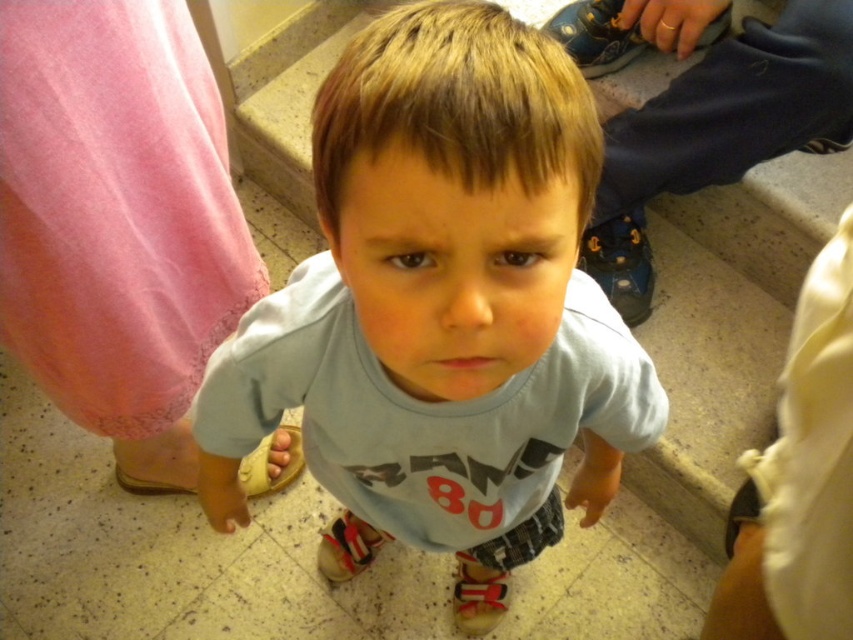
You are a photographer trying to capture a photo of the child in the hallway. You notice two points marked in the image. Which of the two points, point (344, 458) or point (137, 492), is closer to the camera and thus likely to be in focus if you focus on it?

Point (344, 458) is closer to the camera than point (137, 492), so focusing on it would ensure that point is in focus.